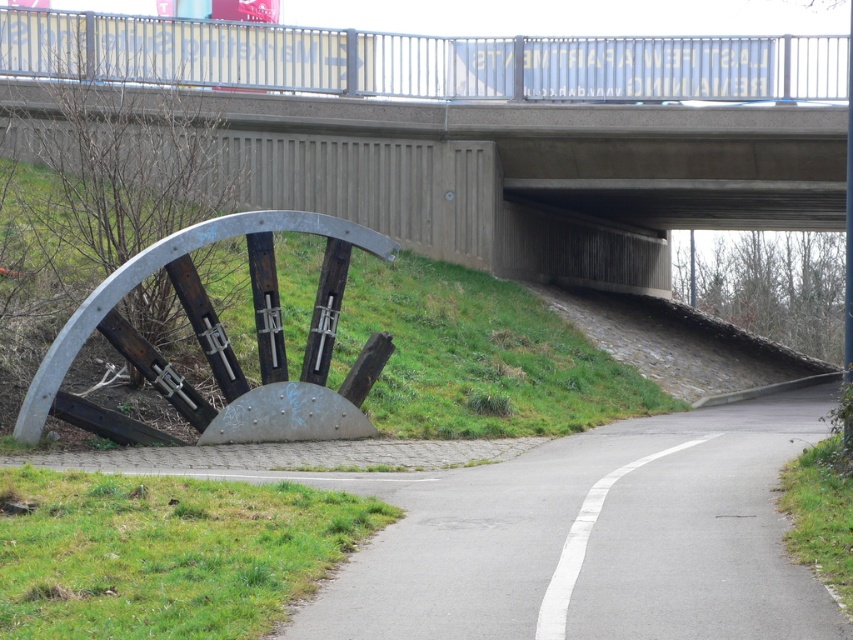
You are standing at the base of the curved metal structure on the grassy embankment. Looking towards the road, where is the concrete bridge at upper center located relative to your position?

The concrete bridge at upper center is located at point 0.200 in the x coordinate and 0.581 in the y coordinate relative to your position.

You are a delivery driver who needs to transport a wide load that is 10 meters wide. You see the concrete bridge at upper center and the gray asphalt road at lower center. Which route can accommodate your load?

The concrete bridge at upper center is wider than the gray asphalt road at lower center, so the concrete bridge at upper center can accommodate the 10 meter wide load.